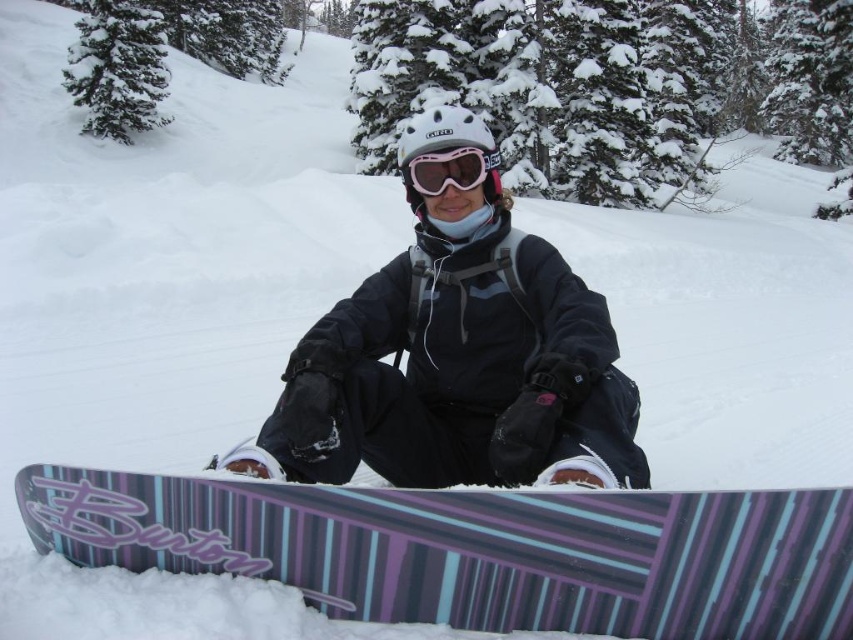
Is point (689, 520) behind point (392, 385)?

No, it is not.

Does purple striped snowboard at lower center have a greater width compared to black matte snowboarder at center?

Yes, purple striped snowboard at lower center is wider than black matte snowboarder at center.

Locate an element on the screen. This screenshot has height=640, width=853. purple striped snowboard at lower center is located at coordinates (477, 550).

Which is behind, point (321, 499) or point (450, 177)?

The point (450, 177) is more distant.

Between purple striped snowboard at lower center and pink reflective goggles at center, which one is positioned higher?

pink reflective goggles at center is above.

At what (x,y) coordinates should I click in order to perform the action: click on purple striped snowboard at lower center. Please return your answer as a coordinate pair (x, y). This screenshot has height=640, width=853. Looking at the image, I should click on (477, 550).

Is black matte snowboarder at center to the right of pink reflective goggles at center from the viewer's perspective?

Incorrect, black matte snowboarder at center is not on the right side of pink reflective goggles at center.

Which of these two, black matte snowboarder at center or pink reflective goggles at center, stands taller?

black matte snowboarder at center

Which is in front, point (454, 237) or point (474, 173)?

Positioned in front is point (474, 173).

You are a GUI agent. You are given a task and a screenshot of the screen. Output one action in this format:
    pyautogui.click(x=<x>, y=<y>)
    Task: Click on the black matte snowboarder at center
    This screenshot has height=640, width=853.
    Given the screenshot: What is the action you would take?
    pyautogui.click(x=457, y=369)